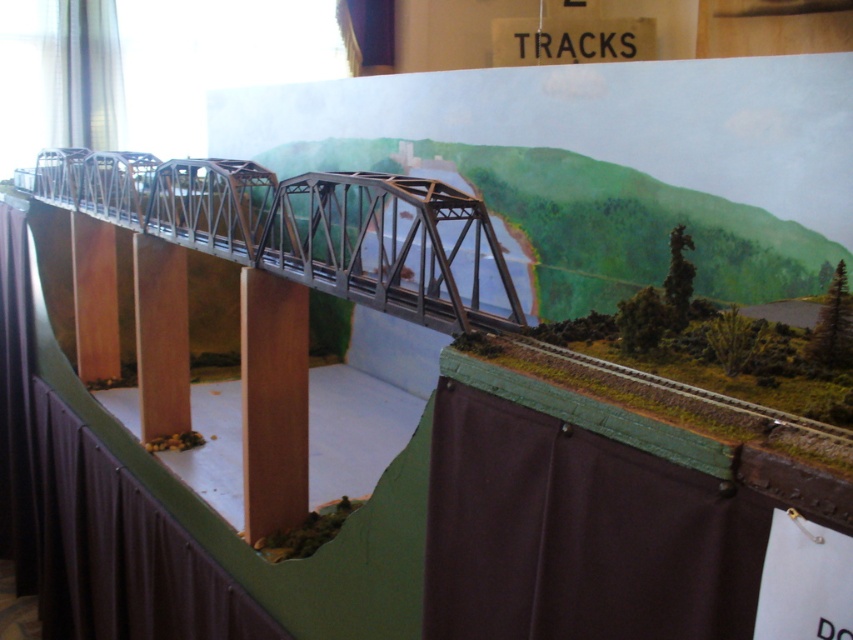
Is metallic gray bridge at center to the left of brown wood pillar at center from the viewer's perspective?

Correct, you'll find metallic gray bridge at center to the left of brown wood pillar at center.

Is metallic gray bridge at center behind brown wood pillar at center?

No, metallic gray bridge at center is closer to the viewer.

Is point (202, 196) farther from viewer compared to point (257, 404)?

Yes, point (202, 196) is behind point (257, 404).

Find the location of a particular element. The image size is (853, 640). metallic gray bridge at center is located at coordinates (296, 240).